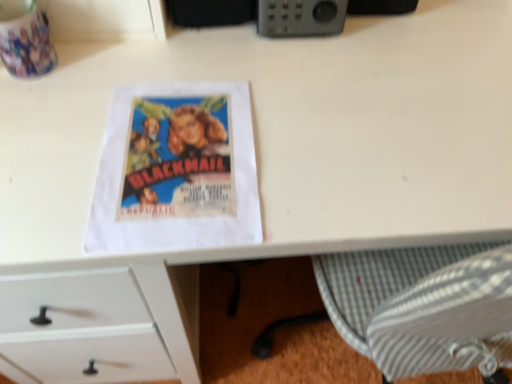
Question: Considering the relative positions of gray plastic radio at upper center and matte paper poster at center in the image provided, is gray plastic radio at upper center to the left or to the right of matte paper poster at center?

Choices:
 (A) left
 (B) right

Answer: (B)

Question: Is point click(x=300, y=0) positioned closer to the camera than point click(x=133, y=185)?

Choices:
 (A) farther
 (B) closer

Answer: (A)

Question: Looking at their shapes, would you say gray plastic radio at upper center is wider or thinner than matte paper poster at center?

Choices:
 (A) thin
 (B) wide

Answer: (A)

Question: Is matte paper poster at center to the left or to the right of gray plastic radio at upper center in the image?

Choices:
 (A) left
 (B) right

Answer: (A)

Question: Looking at their shapes, would you say matte paper poster at center is wider or thinner than gray plastic radio at upper center?

Choices:
 (A) thin
 (B) wide

Answer: (B)

Question: From a real-world perspective, relative to gray plastic radio at upper center, is matte paper poster at center vertically above or below?

Choices:
 (A) below
 (B) above

Answer: (A)

Question: Based on their sizes in the image, would you say matte paper poster at center is bigger or smaller than gray plastic radio at upper center?

Choices:
 (A) big
 (B) small

Answer: (B)